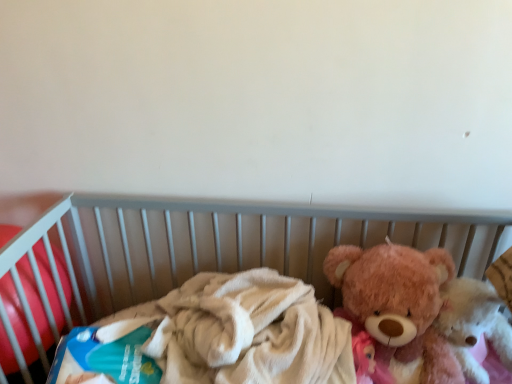
Describe the element at coordinates (394, 312) in the screenshot. I see `fluffy pink teddy bear at right, acting as the 2th teddy bear starting from the right` at that location.

The height and width of the screenshot is (384, 512). What do you see at coordinates (21, 327) in the screenshot?
I see `blue cardboard box at left` at bounding box center [21, 327].

The width and height of the screenshot is (512, 384). Identify the location of fluffy pink teddy bear at right, acting as the 2th teddy bear starting from the right. (394, 312).

From a real-world perspective, is soft plush bear at right on blue cardboard box at left?

No, from a real-world perspective, soft plush bear at right is not above blue cardboard box at left.

Considering the positions of points (245, 219) and (35, 309), is point (245, 219) closer to camera compared to point (35, 309)?

No, it is behind (35, 309).

Is soft plush bear at right oriented towards blue cardboard box at left?

No, soft plush bear at right is not facing towards blue cardboard box at left.

From the image's perspective, is soft plush bear at right over blue cardboard box at left?

No.

Does soft plush bear at right turn towards fluffy pink teddy bear at right, acting as the 2th teddy bear starting from the right?

Yes, soft plush bear at right is facing fluffy pink teddy bear at right, acting as the 2th teddy bear starting from the right.

Which is more to the right, soft plush bear at right or fluffy pink teddy bear at right, acting as the 2th teddy bear starting from the right?

fluffy pink teddy bear at right, acting as the 2th teddy bear starting from the right.

The height and width of the screenshot is (384, 512). Identify the location of teddy bear that is the 2nd object located above the soft plush bear at right (from the image's perspective). (394, 312).

Could fluffy pink teddy bear at right, the 1th teddy bear when ordered from left to right, be considered to be inside soft plush bear at right?

Yes, fluffy pink teddy bear at right, the 1th teddy bear when ordered from left to right, can be found within soft plush bear at right.

Is the position of fluffy pink teddy bear at right, which is counted as the first teddy bear, starting from the right, more distant than that of soft plush bear at right?

Yes, fluffy pink teddy bear at right, which is counted as the first teddy bear, starting from the right, is behind soft plush bear at right.

What's the angular difference between fluffy pink teddy bear at right, which is counted as the first teddy bear, starting from the right, and soft plush bear at right's facing directions?

There is a 1.69-degree angle between the facing directions of fluffy pink teddy bear at right, which is counted as the first teddy bear, starting from the right, and soft plush bear at right.

Is fluffy pink teddy bear at right, which is counted as the first teddy bear, starting from the right, positioned with its back to soft plush bear at right?

Yes, soft plush bear at right is at the back of fluffy pink teddy bear at right, which is counted as the first teddy bear, starting from the right.

From the picture: From the image's perspective, who appears lower, fluffy pink teddy bear at right, which is counted as the first teddy bear, starting from the right, or soft plush bear at right?

soft plush bear at right is shown below in the image.

From a real-world perspective, is soft plush bear at right located higher than fluffy pink teddy bear at right, which ranks as the second teddy bear in left-to-right order?

No.

Which object is closer to the camera, soft plush bear at right or fluffy pink teddy bear at right, which ranks as the second teddy bear in left-to-right order?

soft plush bear at right is in front.

Consider the image. Does soft plush bear at right have a greater height compared to fluffy pink teddy bear at right, which ranks as the second teddy bear in left-to-right order?

Correct, soft plush bear at right is much taller as fluffy pink teddy bear at right, which ranks as the second teddy bear in left-to-right order.

In the scene shown: Relative to fluffy pink teddy bear at right, the 1th teddy bear when ordered from left to right, is fluffy pink teddy bear at right, which is counted as the first teddy bear, starting from the right, in front or behind?

fluffy pink teddy bear at right, which is counted as the first teddy bear, starting from the right, is positioned farther from the viewer than fluffy pink teddy bear at right, the 1th teddy bear when ordered from left to right.

Considering the sizes of objects fluffy pink teddy bear at right, which is counted as the first teddy bear, starting from the right, and fluffy pink teddy bear at right, the 1th teddy bear when ordered from left to right, in the image provided, who is wider, fluffy pink teddy bear at right, which is counted as the first teddy bear, starting from the right, or fluffy pink teddy bear at right, the 1th teddy bear when ordered from left to right,?

fluffy pink teddy bear at right, the 1th teddy bear when ordered from left to right, is wider.

From a real-world perspective, does fluffy pink teddy bear at right, which ranks as the second teddy bear in left-to-right order, stand above fluffy pink teddy bear at right, the 1th teddy bear when ordered from left to right?

Incorrect, from a real-world perspective, fluffy pink teddy bear at right, which ranks as the second teddy bear in left-to-right order, is lower than fluffy pink teddy bear at right, the 1th teddy bear when ordered from left to right.

How many degrees apart are the facing directions of fluffy pink teddy bear at right, which is counted as the first teddy bear, starting from the right, and fluffy pink teddy bear at right, the 1th teddy bear when ordered from left to right?

The angular difference between fluffy pink teddy bear at right, which is counted as the first teddy bear, starting from the right, and fluffy pink teddy bear at right, the 1th teddy bear when ordered from left to right, is 0.000192 degrees.

How much distance is there between fluffy pink teddy bear at right, the 1th teddy bear when ordered from left to right, and soft plush bear at right?

They are 10.38 inches apart.

What's the angular difference between fluffy pink teddy bear at right, acting as the 2th teddy bear starting from the right, and soft plush bear at right's facing directions?

They differ by 1.69 degrees in their facing directions.

Identify the location of infant bed on the left of fluffy pink teddy bear at right, the 1th teddy bear when ordered from left to right. Image resolution: width=512 pixels, height=384 pixels. tap(206, 250).

Considering the relative sizes of fluffy pink teddy bear at right, the 1th teddy bear when ordered from left to right, and soft plush bear at right in the image provided, is fluffy pink teddy bear at right, the 1th teddy bear when ordered from left to right, thinner than soft plush bear at right?

Yes.

Between point (467, 328) and point (3, 325), which one is positioned in front?

The point (3, 325) is closer.

Could you tell me if fluffy pink teddy bear at right, which is counted as the first teddy bear, starting from the right, is turned towards blue cardboard box at left?

No.

Is fluffy pink teddy bear at right, which ranks as the second teddy bear in left-to-right order, to the right of blue cardboard box at left from the viewer's perspective?

Yes, fluffy pink teddy bear at right, which ranks as the second teddy bear in left-to-right order, is to the right of blue cardboard box at left.

Find the location of a particular element. infant bed below the blue cardboard box at left (from a real-world perspective) is located at coordinates (206, 250).

Find the location of a particular element. the 1st teddy bear to the right of the soft plush bear at right, starting your count from the anchor is located at coordinates (394, 312).

Considering their positions, is fluffy pink teddy bear at right, which ranks as the second teddy bear in left-to-right order, positioned further to soft plush bear at right than blue cardboard box at left?

fluffy pink teddy bear at right, which ranks as the second teddy bear in left-to-right order, is positioned further to the anchor soft plush bear at right.

In the scene shown: Based on their spatial positions, is fluffy pink teddy bear at right, the 1th teddy bear when ordered from left to right, or blue cardboard box at left further from soft plush bear at right?

fluffy pink teddy bear at right, the 1th teddy bear when ordered from left to right, is further to soft plush bear at right.

Based on their spatial positions, is fluffy pink teddy bear at right, which ranks as the second teddy bear in left-to-right order, or blue cardboard box at left closer to fluffy pink teddy bear at right, acting as the 2th teddy bear starting from the right?

Based on the image, fluffy pink teddy bear at right, which ranks as the second teddy bear in left-to-right order, appears to be nearer to fluffy pink teddy bear at right, acting as the 2th teddy bear starting from the right.

Looking at this image, based on their spatial positions, is soft plush bear at right or blue cardboard box at left closer to fluffy pink teddy bear at right, which is counted as the first teddy bear, starting from the right?

Based on the image, soft plush bear at right appears to be nearer to fluffy pink teddy bear at right, which is counted as the first teddy bear, starting from the right.

From the image, which object appears to be nearer to blue cardboard box at left, fluffy pink teddy bear at right, which ranks as the second teddy bear in left-to-right order, or soft plush bear at right?

Based on the image, soft plush bear at right appears to be nearer to blue cardboard box at left.

Looking at this image, estimate the real-world distances between objects in this image. Which object is closer to fluffy pink teddy bear at right, the 1th teddy bear when ordered from left to right, blue cardboard box at left or fluffy pink teddy bear at right, which ranks as the second teddy bear in left-to-right order?

Based on the image, fluffy pink teddy bear at right, which ranks as the second teddy bear in left-to-right order, appears to be nearer to fluffy pink teddy bear at right, the 1th teddy bear when ordered from left to right.

Estimate the real-world distances between objects in this image. Which object is closer to fluffy pink teddy bear at right, which is counted as the first teddy bear, starting from the right, blue cardboard box at left or soft plush bear at right?

The object closer to fluffy pink teddy bear at right, which is counted as the first teddy bear, starting from the right, is soft plush bear at right.

Looking at the image, which one is located closer to fluffy pink teddy bear at right, acting as the 2th teddy bear starting from the right, fluffy pink teddy bear at right, which is counted as the first teddy bear, starting from the right, or soft plush bear at right?

The object closer to fluffy pink teddy bear at right, acting as the 2th teddy bear starting from the right, is fluffy pink teddy bear at right, which is counted as the first teddy bear, starting from the right.

Locate an element on the screen. This screenshot has height=384, width=512. infant bed between blue cardboard box at left and fluffy pink teddy bear at right, acting as the 2th teddy bear starting from the right, in the horizontal direction is located at coordinates (206, 250).

What are the coordinates of `infant bed between blue cardboard box at left and fluffy pink teddy bear at right, which ranks as the second teddy bear in left-to-right order, in the horizontal direction` in the screenshot? It's located at click(206, 250).

Identify the location of teddy bear between soft plush bear at right and fluffy pink teddy bear at right, which is counted as the first teddy bear, starting from the right, from front to back. (394, 312).

Locate an element on the screen. Image resolution: width=512 pixels, height=384 pixels. teddy bear between blue cardboard box at left and fluffy pink teddy bear at right, which ranks as the second teddy bear in left-to-right order, in the horizontal direction is located at coordinates (394, 312).